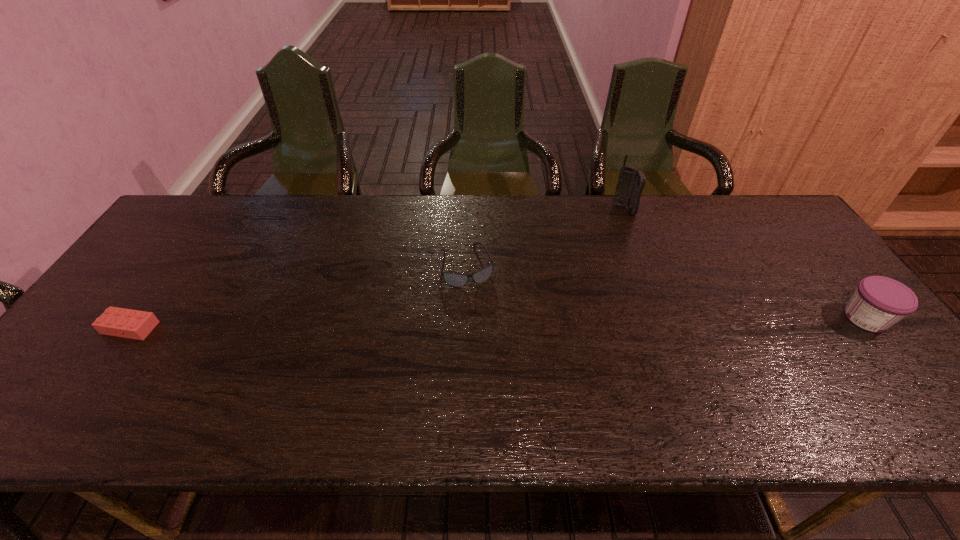
Image resolution: width=960 pixels, height=540 pixels. Identify the location of vacant space on the desktop that is between the leftmost object and the rightmost object and is positioned on the lenses of the second shortest object. (485, 323).

At what (x,y) coordinates should I click in order to perform the action: click on vacant spot on the desktop that is between the Lego and the rightmost object and is positioned on the keyboard of the tallest object. Please return your answer as a coordinate pair (x, y). Looking at the image, I should click on (570, 322).